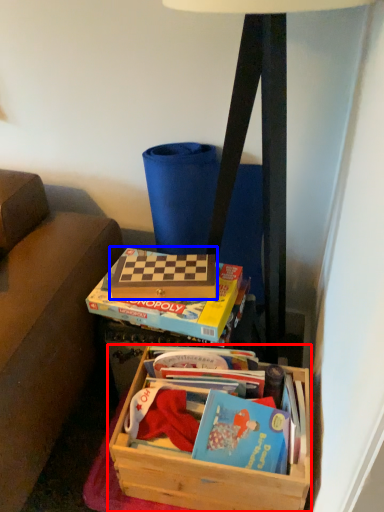
Question: Which of the following is the closest to the observer, box (highlighted by a red box) or paperback book (highlighted by a blue box)?

Choices:
 (A) box
 (B) paperback book

Answer: (A)